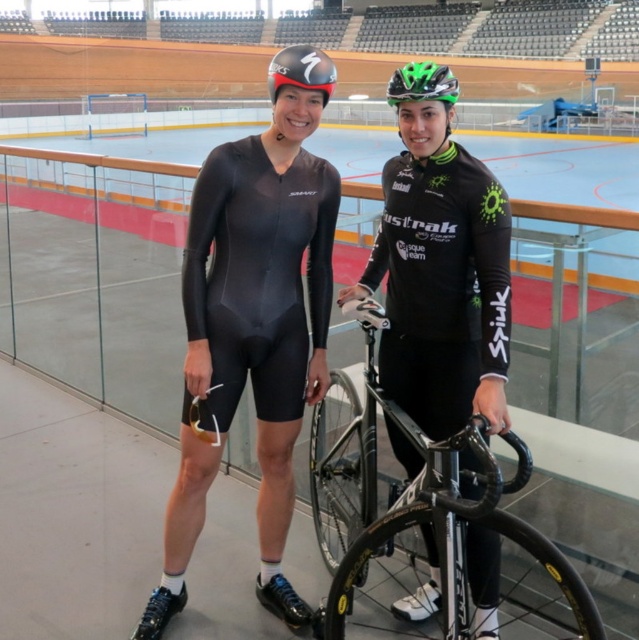
You are an event organizer at the velodrome and need to arrange two items for a display. You have a black matte suit at center and a green matte helmet at upper center. If you want to place them side by side on a shelf, which item should you place first to ensure they fit properly?

The black matte suit at center is wider than the green matte helmet at upper center, so you should place the black matte suit at center first to accommodate its larger width before placing the green matte helmet at upper center.